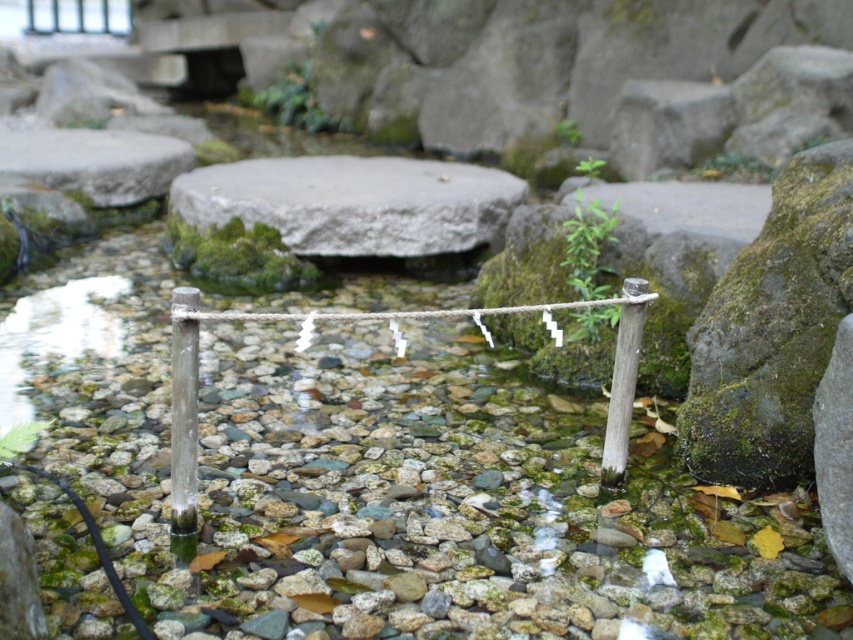
Question: In this image, where is white wood pole at center located relative to white wood pole at right?

Choices:
 (A) right
 (B) left

Answer: (B)

Question: Which object is positioned farthest from the white wood pole at center?

Choices:
 (A) gray stone boulder at center
 (B) white wood pole at right

Answer: (A)

Question: Can you confirm if gray stone boulder at center is thinner than white wood pole at right?

Choices:
 (A) yes
 (B) no

Answer: (B)

Question: Which is nearer to the white wood pole at right?

Choices:
 (A) gray stone boulder at center
 (B) white wood pole at center

Answer: (B)

Question: Which object appears farthest from the camera in this image?

Choices:
 (A) white wood pole at right
 (B) white wood pole at center

Answer: (A)

Question: Can you confirm if white wood pole at center is positioned to the left of white wood pole at right?

Choices:
 (A) yes
 (B) no

Answer: (A)